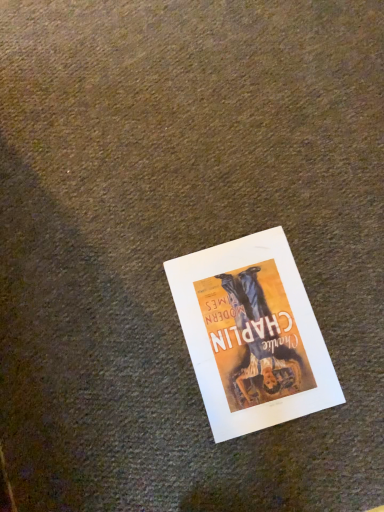
I want to click on free spot above white paper poster at center (from a real-world perspective), so click(250, 328).